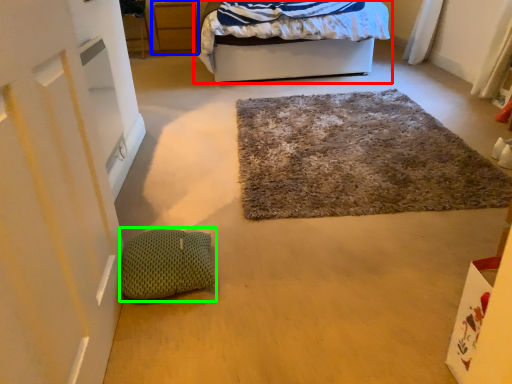
Question: Which object is the closest to the bed (highlighted by a red box)? Choose among these: cabinetry (highlighted by a blue box) or pillow (highlighted by a green box).

Choices:
 (A) cabinetry
 (B) pillow

Answer: (A)